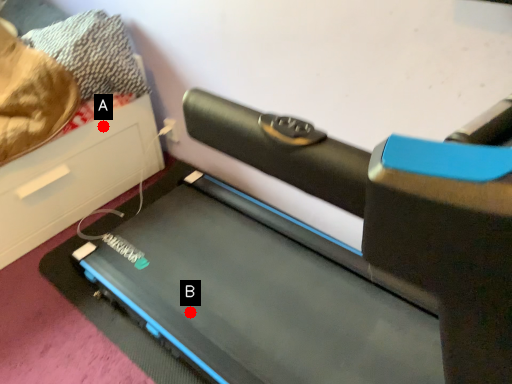
Question: Two points are circled on the image, labeled by A and B beside each circle. Which point is closer to the camera?

Choices:
 (A) A is closer
 (B) B is closer

Answer: (B)